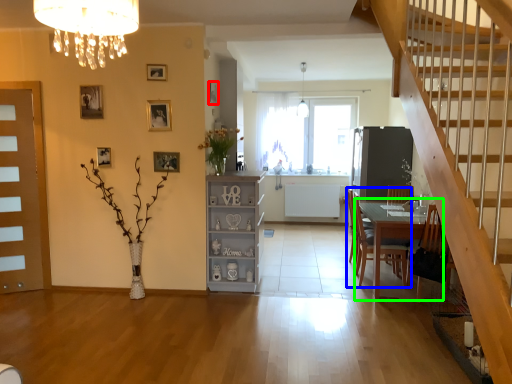
Question: Which object is the farthest from picture frame (highlighted by a red box)? Choose among these: chair (highlighted by a blue box) or table (highlighted by a green box).

Choices:
 (A) chair
 (B) table

Answer: (B)